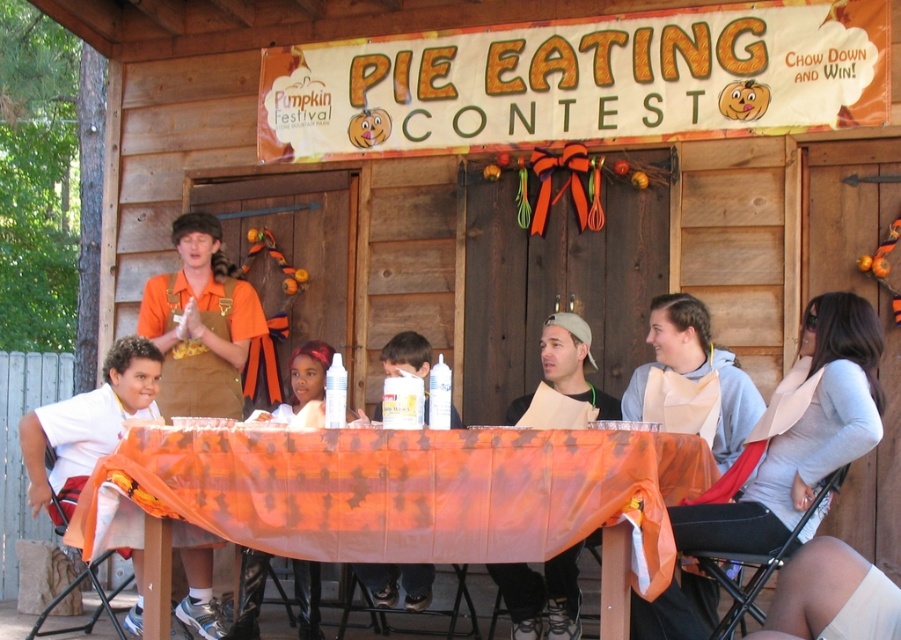
Can you confirm if light beige paper bib at lower right is positioned to the right of white glossy can at center?

Yes, light beige paper bib at lower right is to the right of white glossy can at center.

This screenshot has width=901, height=640. What do you see at coordinates (802, 433) in the screenshot?
I see `light beige paper bib at lower right` at bounding box center [802, 433].

Between point (679, 596) and point (399, 356), which one is positioned behind?

Point (399, 356)

The height and width of the screenshot is (640, 901). I want to click on light beige paper bib at lower right, so click(x=802, y=433).

Between point (302, 445) and point (596, 419), which one is positioned behind?

Point (596, 419)

From the picture: Which is below, orange sheer fabric at center or white paper bib at center?

orange sheer fabric at center

You are a GUI agent. You are given a task and a screenshot of the screen. Output one action in this format:
    pyautogui.click(x=<x>, y=<y>)
    Task: Click on the orange sheer fabric at center
    Image resolution: width=901 pixels, height=640 pixels.
    Given the screenshot: What is the action you would take?
    pyautogui.click(x=405, y=492)

Locate an element on the screen. The height and width of the screenshot is (640, 901). orange sheer fabric at center is located at coordinates (405, 492).

Which is below, orange fabric apron at left or white matte shirt at left?

white matte shirt at left is below.

Does orange fabric apron at left appear under white matte shirt at left?

Actually, orange fabric apron at left is above white matte shirt at left.

Identify the location of orange fabric apron at left. (199, 323).

Image resolution: width=901 pixels, height=640 pixels. I want to click on orange fabric apron at left, so click(x=199, y=323).